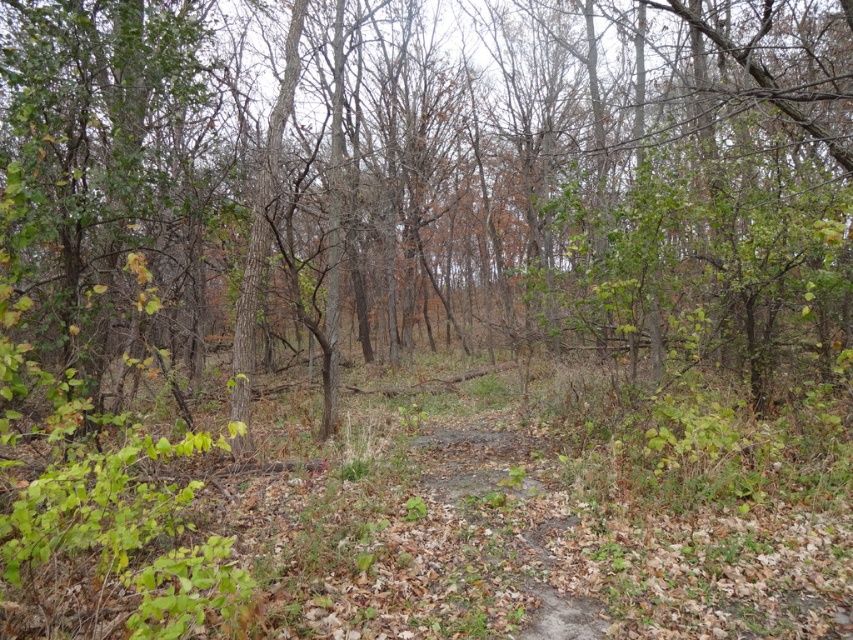
Looking at this image, you are a hiker standing on the dirt path at center. You want to take a photo of the brown bark tree at center from the base to the top. Can you capture the entire tree in one shot without moving your camera?

The brown bark tree at center is much taller than the dirt path at center. Since the tree is significantly taller, it might extend beyond the camera frame if you try to capture it from the base to the top while standing on the dirt path at center. You may need to move back or use a wider lens to include the entire tree in the photo.

You are hiking along the dirt path at center and want to take a photo of the brown bark tree at center. Since the tree is in your way, can you step aside to get a clear view?

The brown bark tree at center is above the dirt path at center, so you can step aside along the dirt path at center to get a clear view of the tree without obstruction.